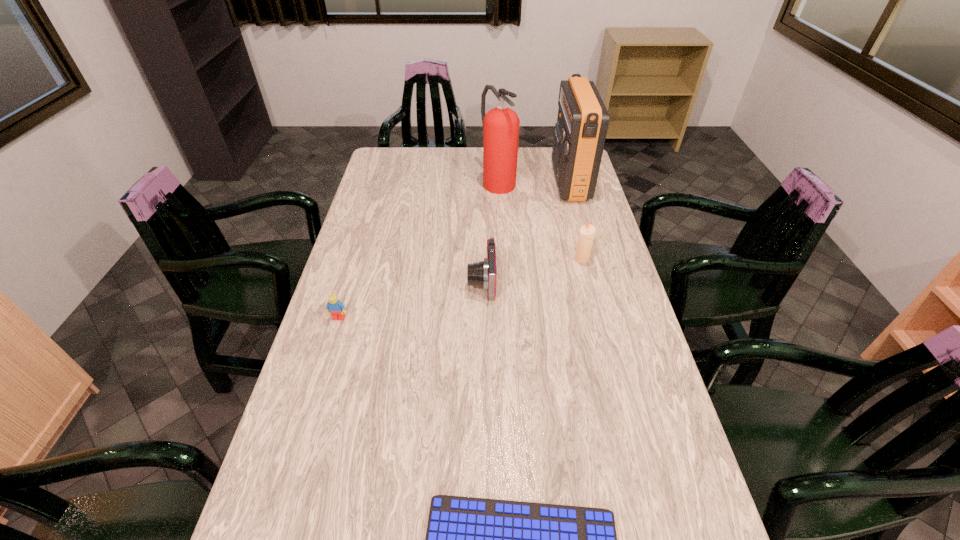
Where is `unoccupied position between the camera and the candle`? unoccupied position between the camera and the candle is located at coordinates (532, 270).

Identify which object is the closest to the fourth shortest object. Please provide its 2D coordinates. Your answer should be formatted as a tuple, i.e. [(x, y)], where the tuple contains the x and y coordinates of a point satisfying the conditions above.

[(482, 274)]

Find the location of `object that is the closest to the radio receiver`. object that is the closest to the radio receiver is located at coordinates (501, 124).

Find the location of a particular element. The width and height of the screenshot is (960, 540). vacant area that satisfies the following two spatial constraints: 1. on the handle side of the fire extinguisher; 2. on the front-facing side of the camera is located at coordinates (503, 281).

Identify the location of blank space that satisfies the following two spatial constraints: 1. on the handle side of the fire extinguisher; 2. on the front-facing side of the camera. Image resolution: width=960 pixels, height=540 pixels. (503, 281).

At what (x,y) coordinates should I click in order to perform the action: click on vacant space that satisfies the following two spatial constraints: 1. on the handle side of the fire extinguisher; 2. on the front-facing side of the camera. Please return your answer as a coordinate pair (x, y). The image size is (960, 540). Looking at the image, I should click on (503, 281).